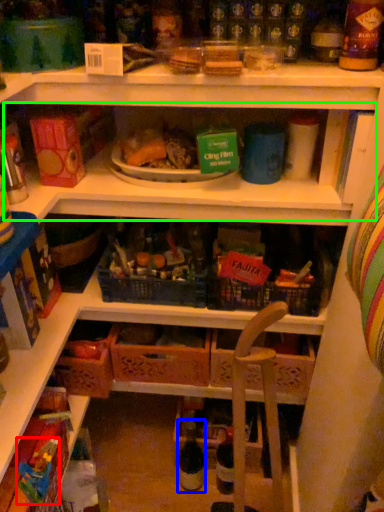
Question: Estimate the real-world distances between objects in this image. Which object is closer to toy (highlighted by a red box), bottle (highlighted by a blue box) or shelf (highlighted by a green box)?

Choices:
 (A) bottle
 (B) shelf

Answer: (A)